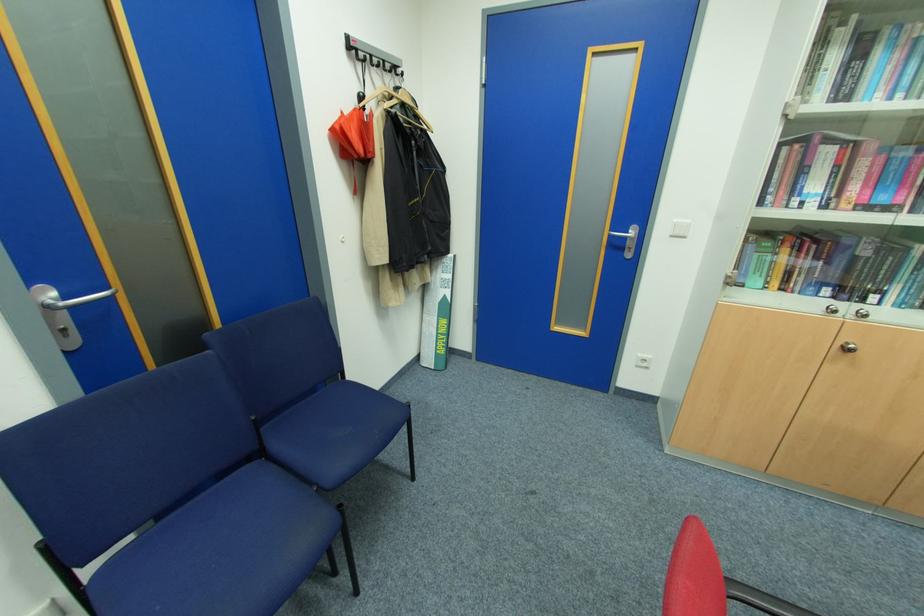
Identify the location of white power outlet. Image resolution: width=924 pixels, height=616 pixels. (642, 361).